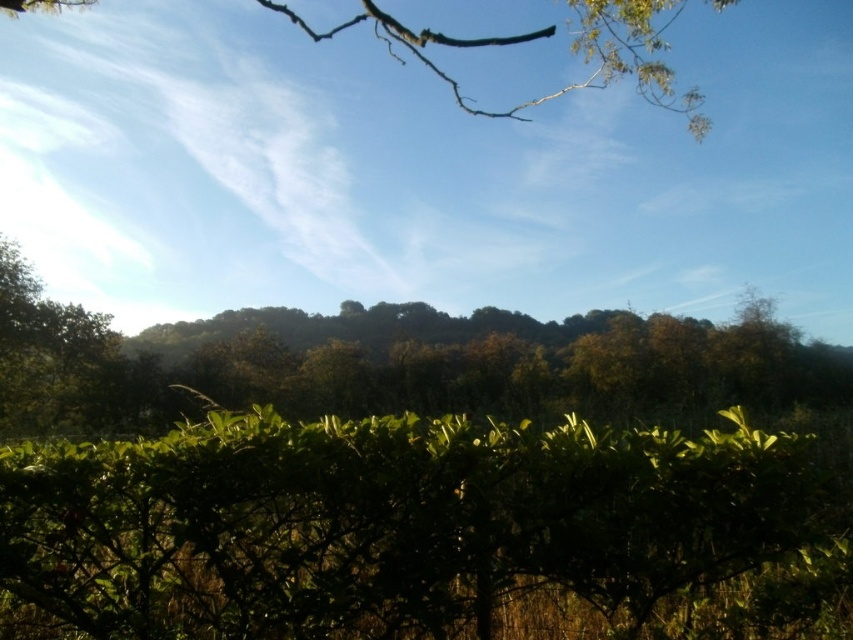
Question: Which point is farther to the camera?

Choices:
 (A) green leafy branch at upper center
 (B) green leafy hedge at lower center

Answer: (A)

Question: Is the position of green leafy hedge at lower center less distant than that of green leafy branch at upper center?

Choices:
 (A) no
 (B) yes

Answer: (B)

Question: Which of the following is the closest to the observer?

Choices:
 (A) (572, 531)
 (B) (312, 32)

Answer: (A)

Question: Observing the image, what is the correct spatial positioning of green leafy hedge at lower center in reference to green leafy branch at upper center?

Choices:
 (A) left
 (B) right

Answer: (A)

Question: Can you confirm if green leafy hedge at lower center is bigger than green leafy branch at upper center?

Choices:
 (A) no
 (B) yes

Answer: (A)